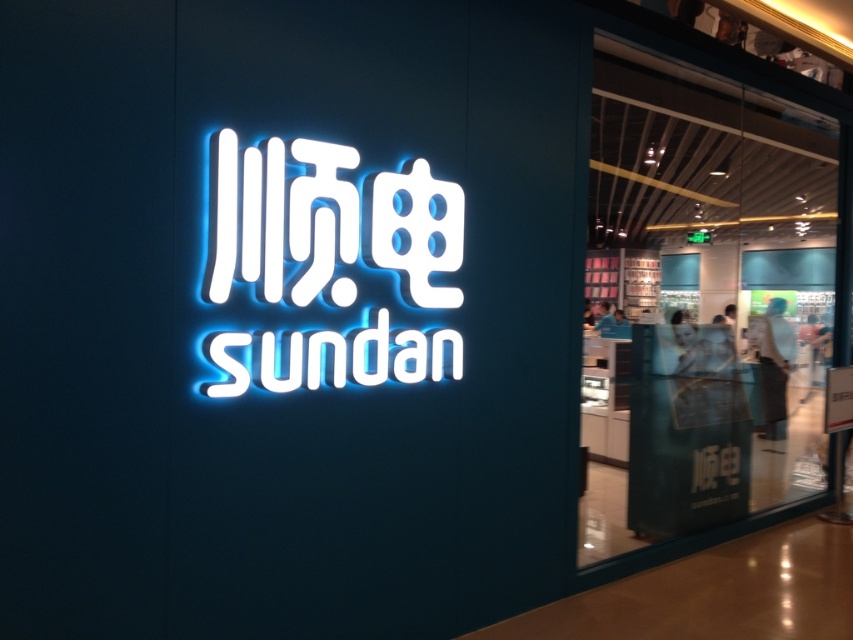
Who is more distant from viewer, [821,387] or [218,166]?

The point [821,387] is behind.

Can you confirm if white glossy sign at center is positioned to the right of neon white sign at center?

Yes, white glossy sign at center is to the right of neon white sign at center.

You are a GUI agent. You are given a task and a screenshot of the screen. Output one action in this format:
    pyautogui.click(x=<x>, y=<y>)
    Task: Click on the white glossy sign at center
    Image resolution: width=853 pixels, height=640 pixels.
    Given the screenshot: What is the action you would take?
    (x=701, y=300)

The image size is (853, 640). Find the location of `white glossy sign at center`. white glossy sign at center is located at coordinates (701, 300).